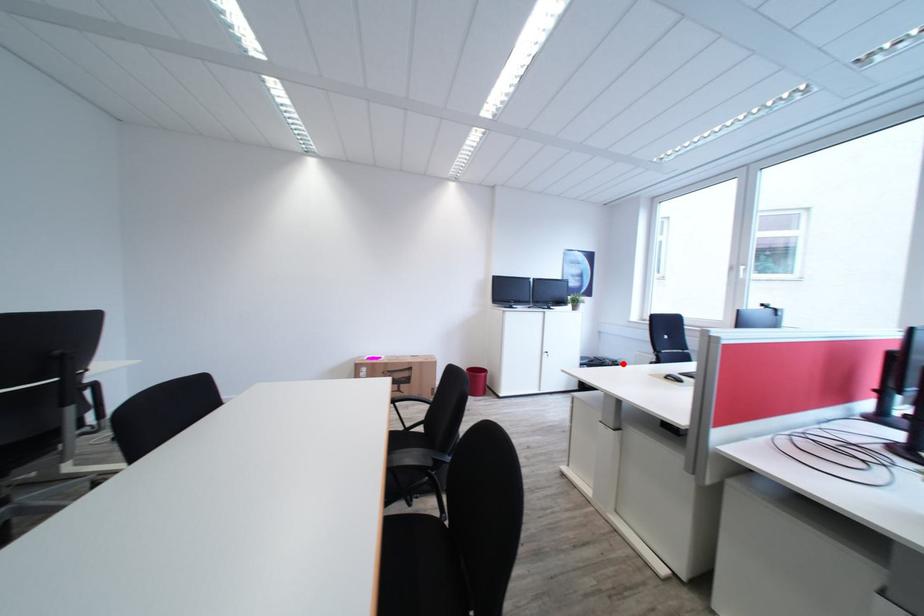
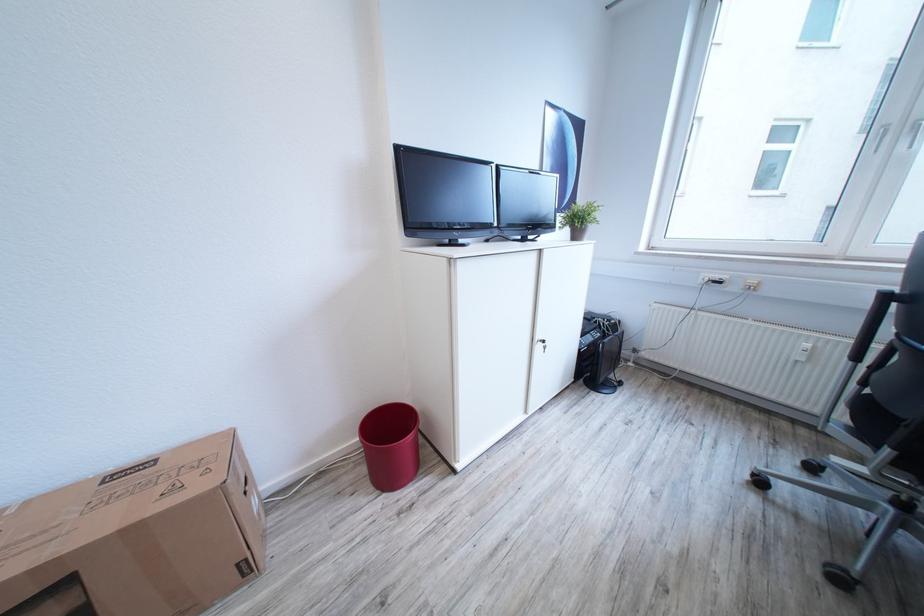
Find the pixel in the second image that matches the highlighted location in the first image.

(619, 323)